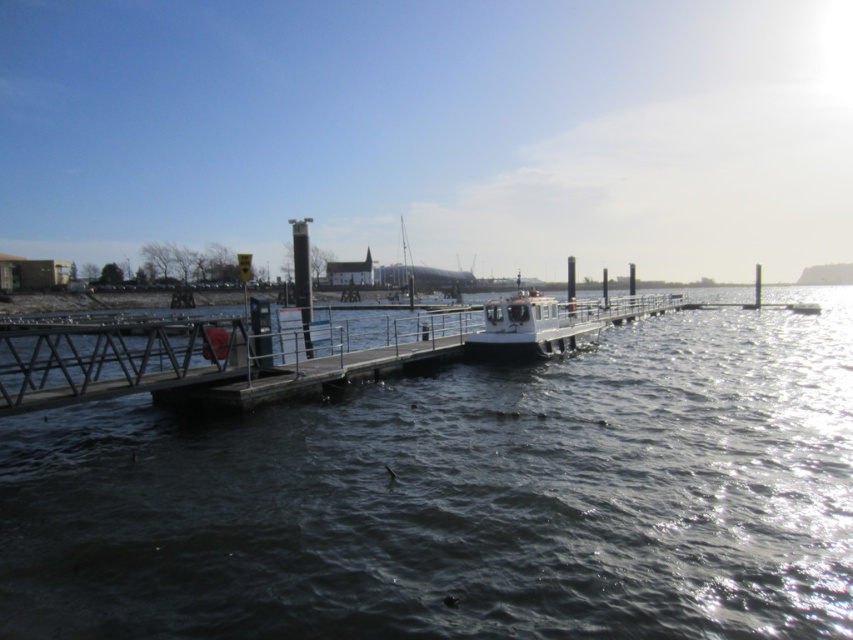
Question: Where is dark water at center located in relation to white matte boat at center in the image?

Choices:
 (A) right
 (B) left

Answer: (A)

Question: Does dark water at center appear over white matte boat at center?

Choices:
 (A) no
 (B) yes

Answer: (A)

Question: Which point appears closest to the camera in this image?

Choices:
 (A) (670, 556)
 (B) (584, 324)

Answer: (A)

Question: Can you confirm if dark water at center is positioned above white matte boat at center?

Choices:
 (A) no
 (B) yes

Answer: (A)

Question: Among these points, which one is nearest to the camera?

Choices:
 (A) (534, 296)
 (B) (378, 632)

Answer: (B)